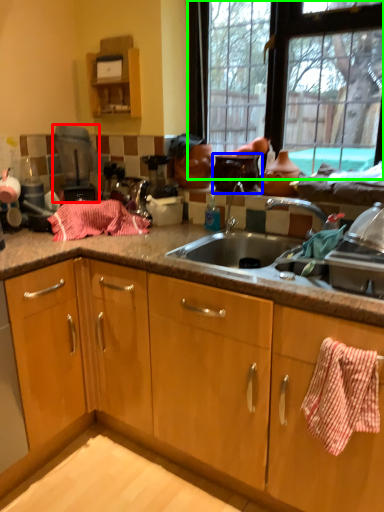
Question: Which is nearer to the appliance (highlighted by a red box)? appliance (highlighted by a blue box) or window (highlighted by a green box).

Choices:
 (A) appliance
 (B) window

Answer: (A)